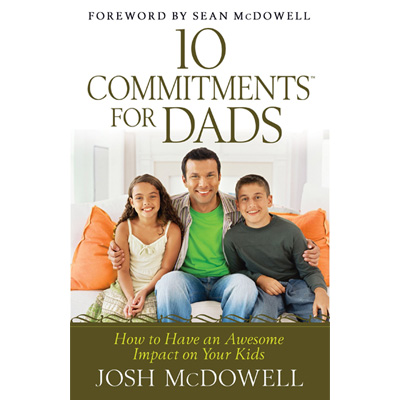
I want to click on door, so click(258, 170).